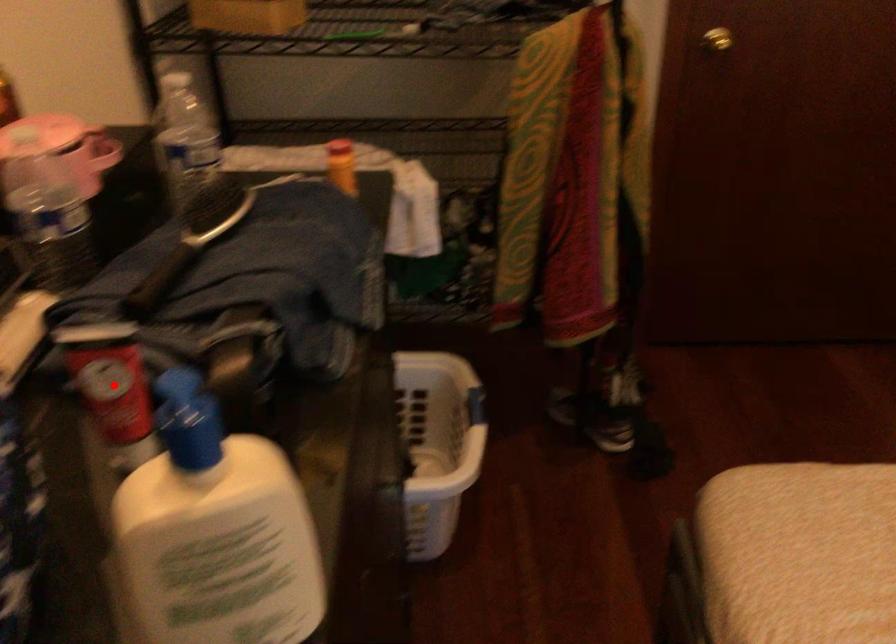
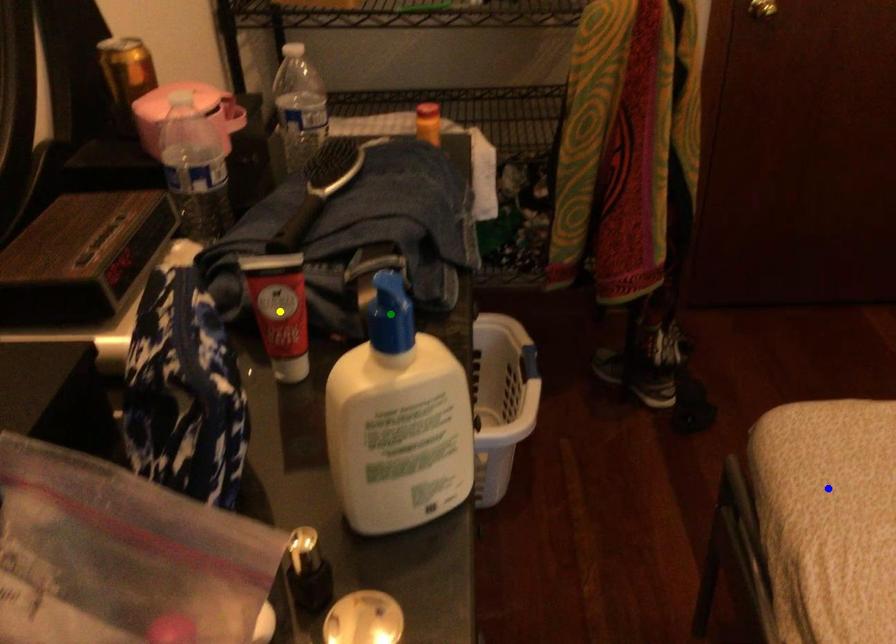
Question: I am providing you with two images of the same scene from different viewpoints. A red point is marked on the first image. You are given multiple points on the second image. Which mark in image 2 goes with the point in image 1?

Choices:
 (A) green point
 (B) blue point
 (C) yellow point

Answer: (C)